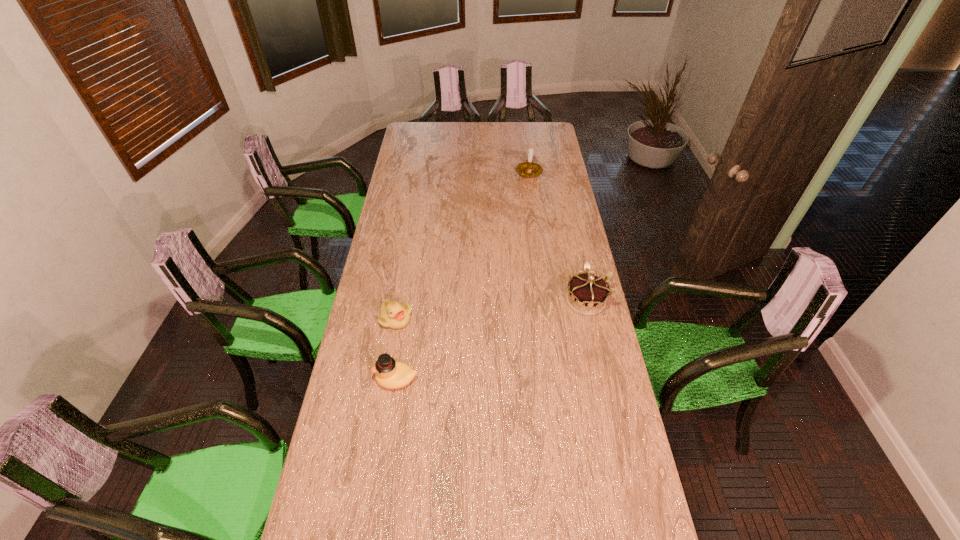
Where is `vacant area between the crown and the nearest object`? This screenshot has width=960, height=540. vacant area between the crown and the nearest object is located at coordinates (492, 340).

Point out which object is positioned as the third nearest to the tallest object. Please provide its 2D coordinates. Your answer should be formatted as a tuple, i.e. [(x, y)], where the tuple contains the x and y coordinates of a point satisfying the conditions above.

[(389, 373)]

Identify which object is the nearest to the nearest object. Please provide its 2D coordinates. Your answer should be formatted as a tuple, i.e. [(x, y)], where the tuple contains the x and y coordinates of a point satisfying the conditions above.

[(394, 315)]

The width and height of the screenshot is (960, 540). I want to click on free space that satisfies the following two spatial constraints: 1. on the back side of the candle holder; 2. on the left side of the shortest object, so click(x=420, y=173).